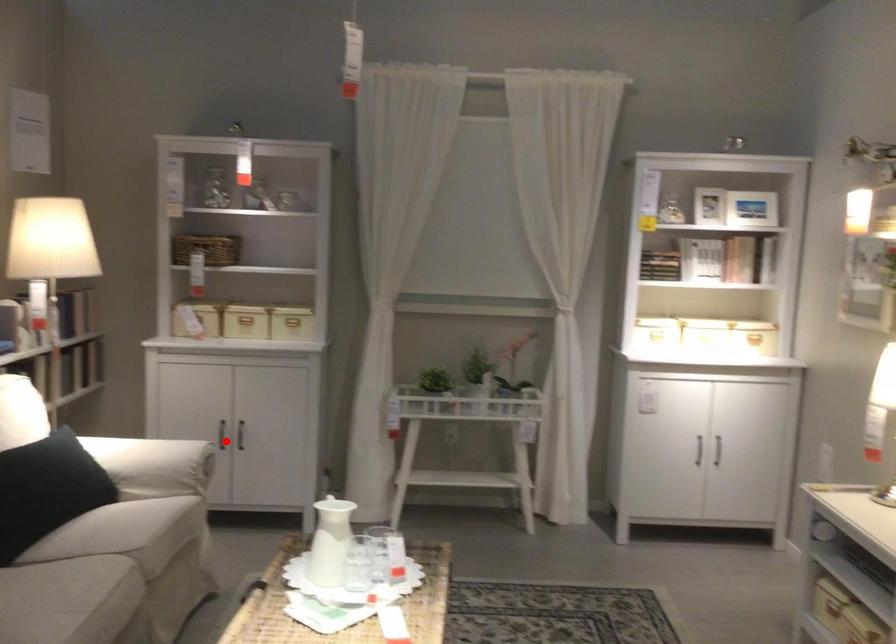
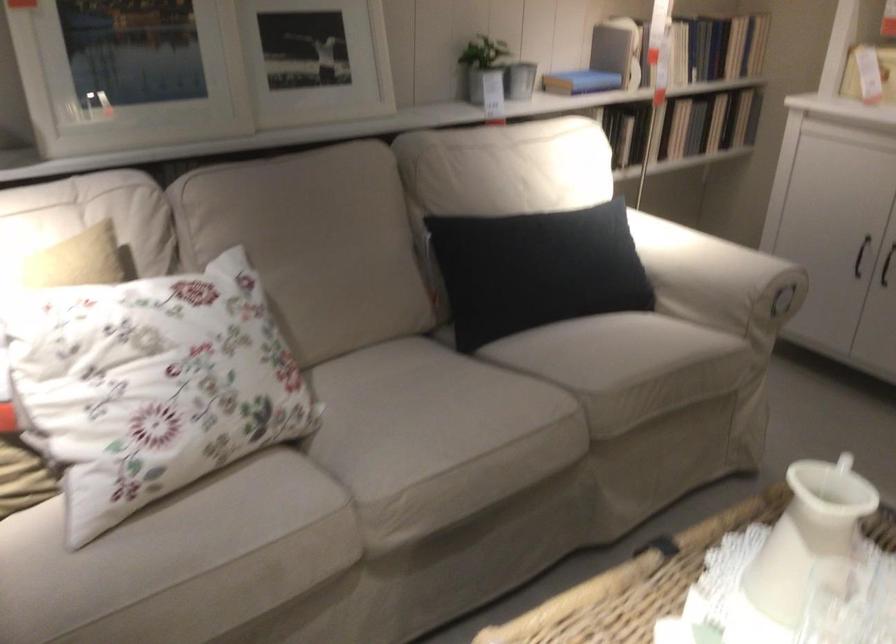
Find the pixel in the second image that matches the highlighted location in the first image.

(860, 256)